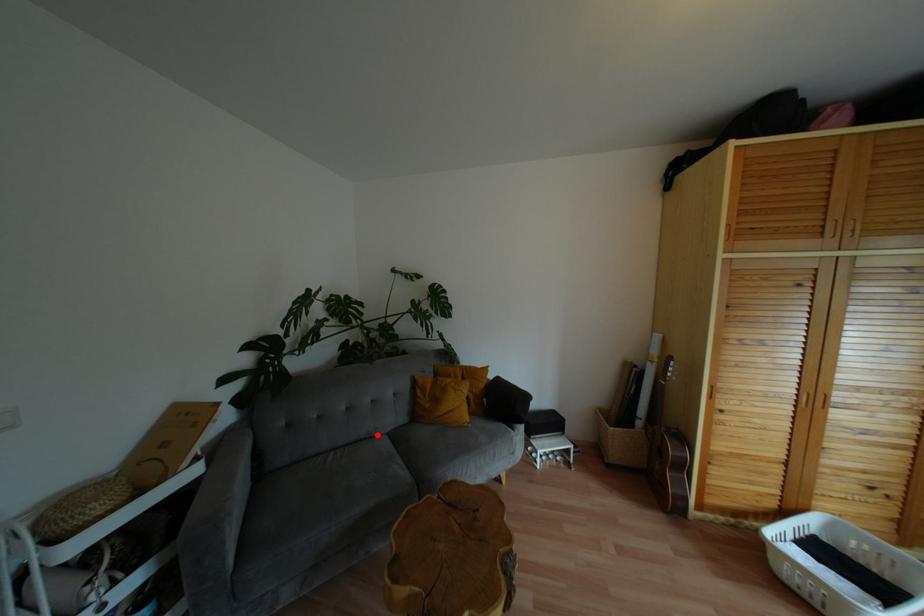
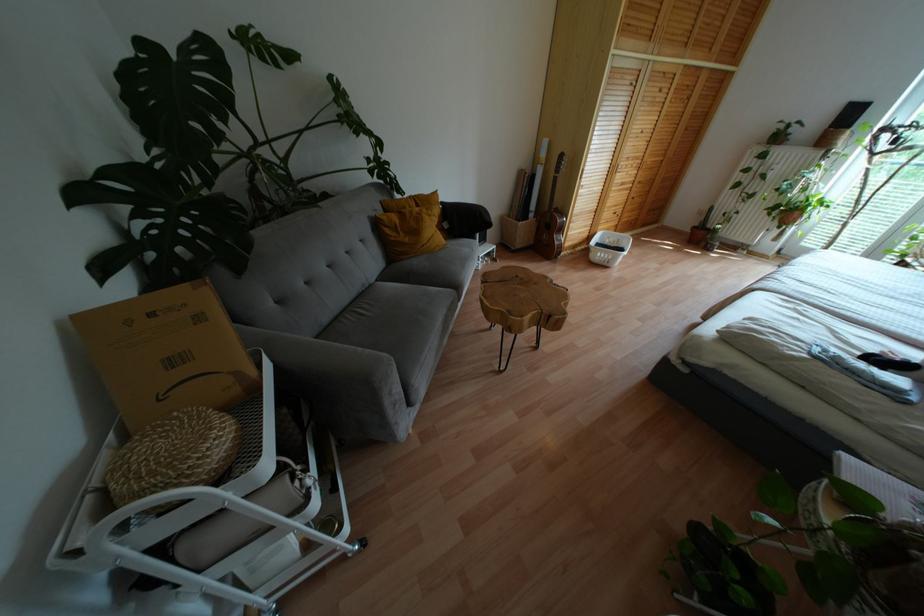
Locate, in the second image, the point that corresponds to the highlighted location in the first image.

(370, 284)